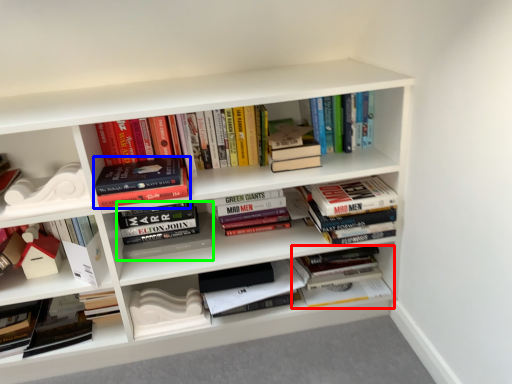
Question: Based on their relative distances, which object is farther from book (highlighted by a red box)? Choose from book (highlighted by a blue box) and book (highlighted by a green box).

Choices:
 (A) book
 (B) book

Answer: (A)